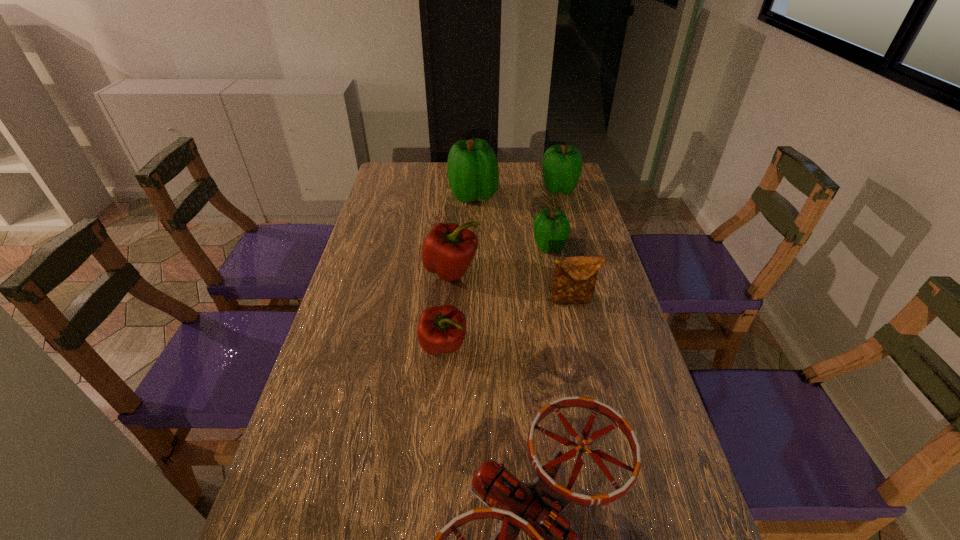
The image size is (960, 540). I want to click on free location located on the right of the bigger pink bell pepper, so click(496, 271).

Find the location of a particular element. vacant space located 0.330m on the open side of the fifth farthest object is located at coordinates point(599,414).

The image size is (960, 540). Identify the location of free space located 0.250m on the left of the nearest green bell pepper. (456, 246).

Locate an element on the screen. blank area located on the right of the smaller pink bell pepper is located at coordinates (577, 347).

The image size is (960, 540). Find the location of `clutch bag positioned at the right edge`. clutch bag positioned at the right edge is located at coordinates (574, 279).

Find the location of a particular element. The image size is (960, 540). object that is positioned at the far right corner is located at coordinates (562, 165).

The image size is (960, 540). I want to click on free space at the far edge of the desktop, so (438, 172).

Locate an element on the screen. vacant region at the left edge of the desktop is located at coordinates (x=388, y=246).

I want to click on vacant space at the right edge, so click(x=646, y=443).

This screenshot has width=960, height=540. Find the location of `free region at the far left corner of the desktop`. free region at the far left corner of the desktop is located at coordinates (385, 190).